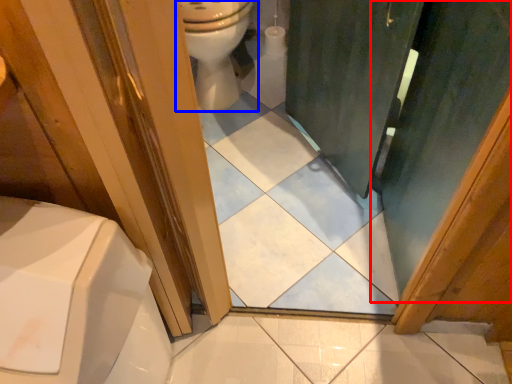
Question: Which of the following is the closest to the observer, screen door (highlighted by a red box) or toilet (highlighted by a blue box)?

Choices:
 (A) screen door
 (B) toilet

Answer: (A)